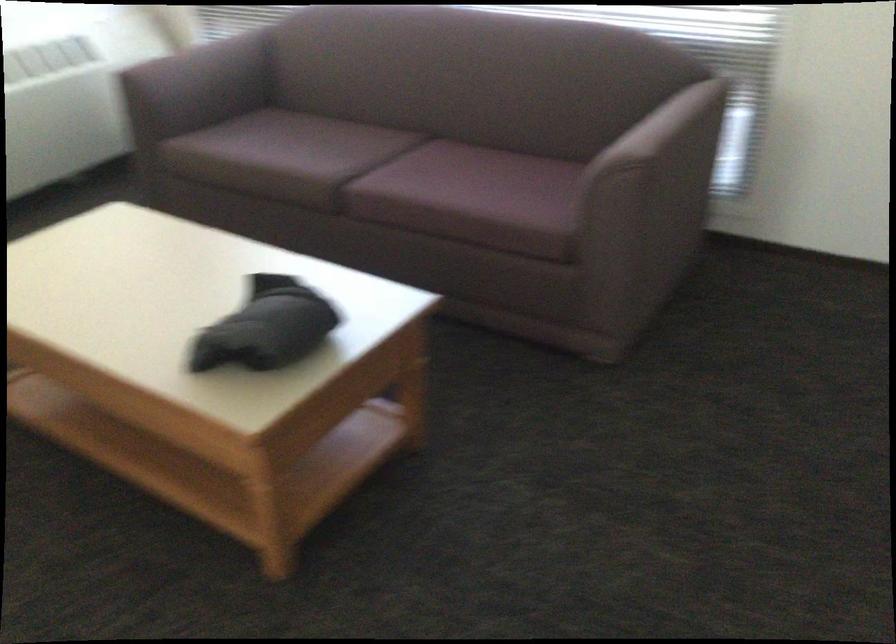
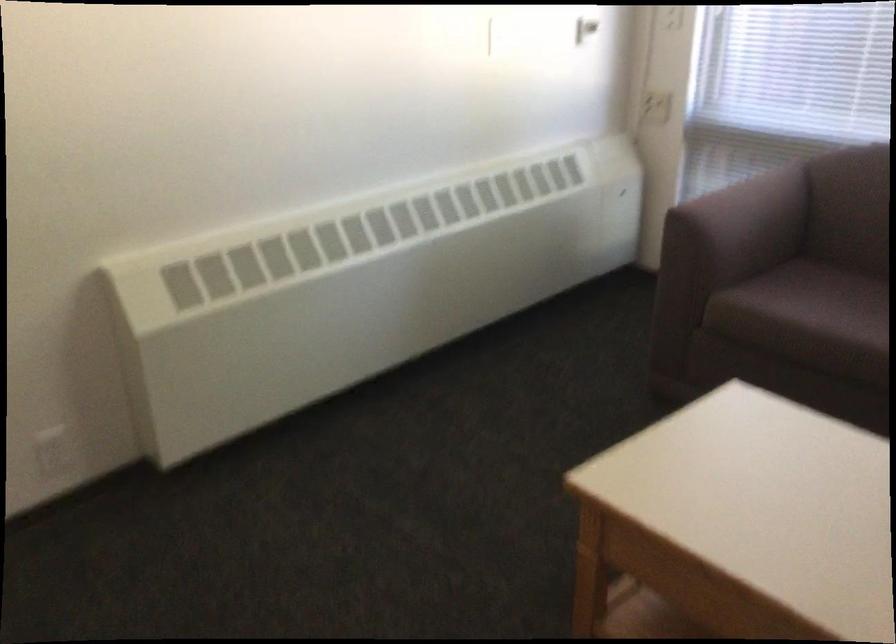
Locate, in the second image, the point that corresponds to the point at 231,138 in the first image.

(807, 303)